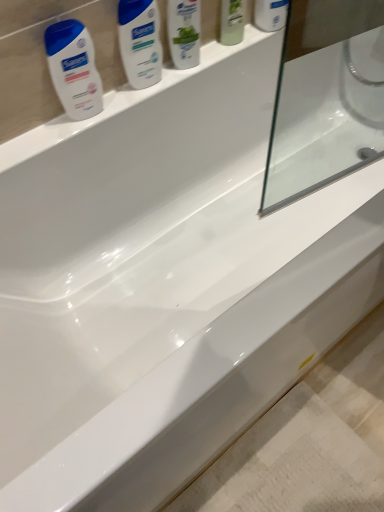
Question: Should I look upward or downward to see white glossy shampoo at upper center, positioned as the first cleaning product in top-to-bottom order?

Choices:
 (A) down
 (B) up

Answer: (B)

Question: Does green matte mouthwash at upper center, the 2th mouthwash in the right-to-left sequence, come behind white glossy lotion at upper left, which ranks as the 2th cleaning product in top-to-bottom order?

Choices:
 (A) no
 (B) yes

Answer: (B)

Question: From a real-world perspective, is green matte mouthwash at upper center, the 2th mouthwash in the right-to-left sequence, on white glossy lotion at upper left, which ranks as the 2th cleaning product in top-to-bottom order?

Choices:
 (A) no
 (B) yes

Answer: (B)

Question: From the image's perspective, is green matte mouthwash at upper center, placed as the 1th mouthwash when sorted from left to right, beneath white glossy lotion at upper left, the first cleaning product viewed from the left?

Choices:
 (A) yes
 (B) no

Answer: (B)

Question: Does green matte mouthwash at upper center, placed as the 1th mouthwash when sorted from left to right, have a lesser height compared to white glossy lotion at upper left, marked as the 2th cleaning product in a right-to-left arrangement?

Choices:
 (A) no
 (B) yes

Answer: (A)

Question: Is the position of green matte mouthwash at upper center, the 2th mouthwash in the right-to-left sequence, less distant than that of white glossy lotion at upper left, the first cleaning product viewed from the left?

Choices:
 (A) no
 (B) yes

Answer: (A)

Question: Is white glossy lotion at upper left, the first cleaning product from the bottom, completely or partially inside green matte mouthwash at upper center, placed as the 1th mouthwash when sorted from left to right?

Choices:
 (A) no
 (B) yes

Answer: (A)

Question: Does white glossy lotion at upper left, which ranks as the 2th cleaning product in top-to-bottom order, lie in front of white glossy mouthwash at upper center, the second mouthwash in the left-to-right sequence?

Choices:
 (A) no
 (B) yes

Answer: (B)

Question: Is the depth of white glossy lotion at upper left, which ranks as the 2th cleaning product in top-to-bottom order, greater than that of white glossy mouthwash at upper center, the second mouthwash in the left-to-right sequence?

Choices:
 (A) yes
 (B) no

Answer: (B)

Question: Does white glossy lotion at upper left, the first cleaning product viewed from the left, turn towards white glossy mouthwash at upper center, the second mouthwash in the left-to-right sequence?

Choices:
 (A) no
 (B) yes

Answer: (A)

Question: Considering the relative sizes of white glossy lotion at upper left, the first cleaning product from the bottom, and white glossy mouthwash at upper center, which is counted as the 1th mouthwash, starting from the right, in the image provided, is white glossy lotion at upper left, the first cleaning product from the bottom, bigger than white glossy mouthwash at upper center, which is counted as the 1th mouthwash, starting from the right,?

Choices:
 (A) yes
 (B) no

Answer: (B)

Question: Does white glossy lotion at upper left, which ranks as the 2th cleaning product in top-to-bottom order, have a greater width compared to white glossy mouthwash at upper center, the second mouthwash in the left-to-right sequence?

Choices:
 (A) yes
 (B) no

Answer: (B)

Question: Is white glossy lotion at upper left, which ranks as the 2th cleaning product in top-to-bottom order, next to white glossy mouthwash at upper center, the second mouthwash in the left-to-right sequence, and touching it?

Choices:
 (A) no
 (B) yes

Answer: (A)

Question: Considering the relative sizes of white glossy mouthwash at upper center, which is counted as the 1th mouthwash, starting from the right, and white glossy lotion at upper left, the first cleaning product from the bottom, in the image provided, is white glossy mouthwash at upper center, which is counted as the 1th mouthwash, starting from the right, wider than white glossy lotion at upper left, the first cleaning product from the bottom,?

Choices:
 (A) no
 (B) yes

Answer: (B)